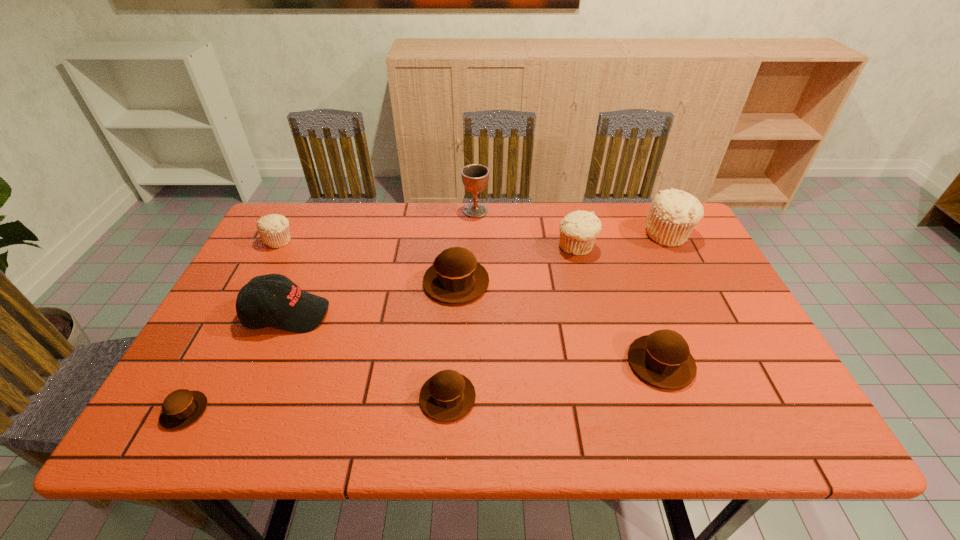
In order to click on vacant space that satisfies the following two spatial constraints: 1. on the back side of the biggest beige muffin; 2. on the right side of the second smallest brown muffin in this screenshot , I will do `click(458, 234)`.

The image size is (960, 540). Find the location of `blank area in the image that satisfies the following two spatial constraints: 1. on the back side of the farthest brown muffin; 2. on the right side of the second shortest muffin`. blank area in the image that satisfies the following two spatial constraints: 1. on the back side of the farthest brown muffin; 2. on the right side of the second shortest muffin is located at coordinates (455, 282).

Find the location of `free space in the image that satisfies the following two spatial constraints: 1. on the back side of the leftmost beige muffin; 2. on the right side of the tallest muffin`. free space in the image that satisfies the following two spatial constraints: 1. on the back side of the leftmost beige muffin; 2. on the right side of the tallest muffin is located at coordinates (282, 234).

You are a GUI agent. You are given a task and a screenshot of the screen. Output one action in this format:
    pyautogui.click(x=<x>, y=<y>)
    Task: Click on the vacant space that satisfies the following two spatial constraints: 1. on the back side of the farthest brown muffin; 2. on the left side of the third biggest brown muffin
    
    Given the screenshot: What is the action you would take?
    (x=455, y=282)